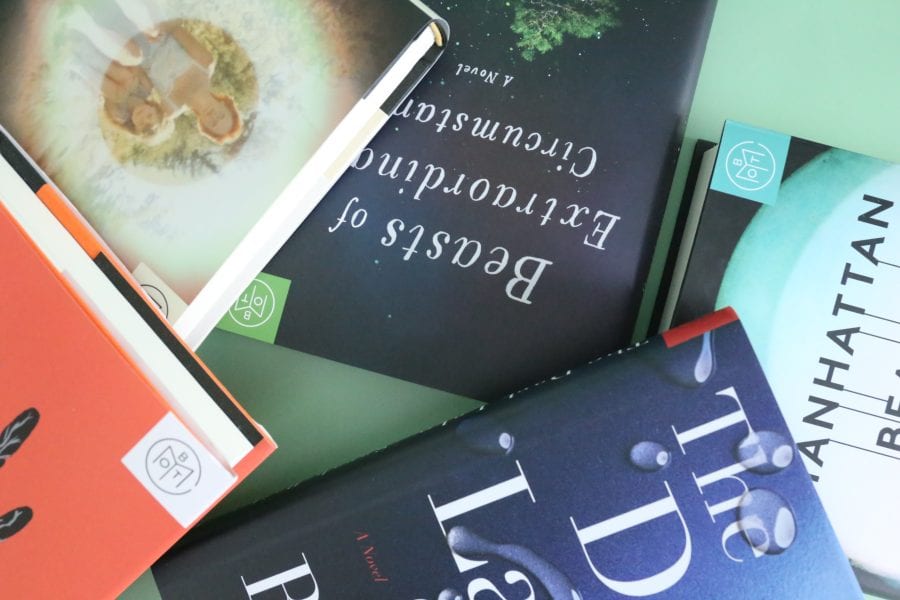
The width and height of the screenshot is (900, 600). I want to click on black book, so click(617, 94).